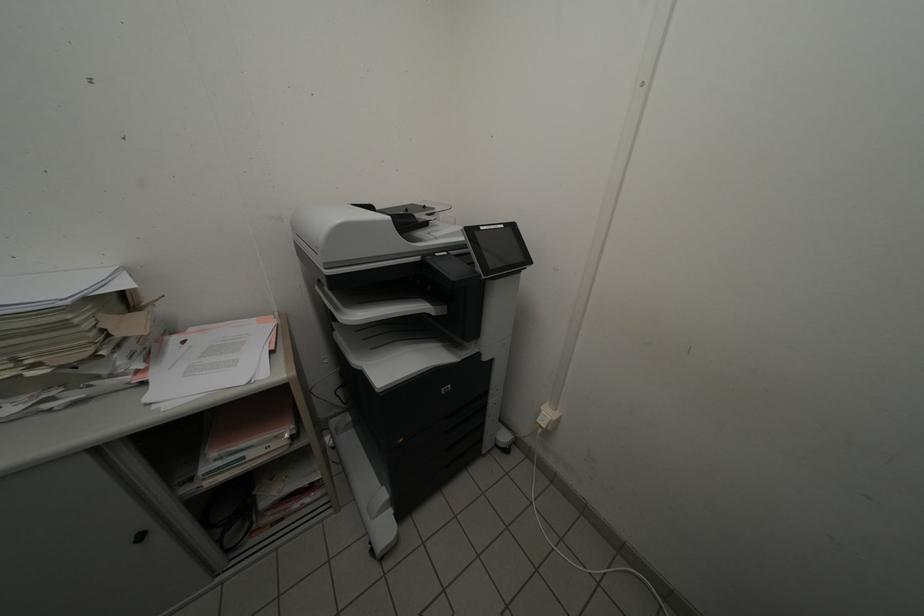
This screenshot has width=924, height=616. Find the location of `printer top cover`. printer top cover is located at coordinates (356, 219).